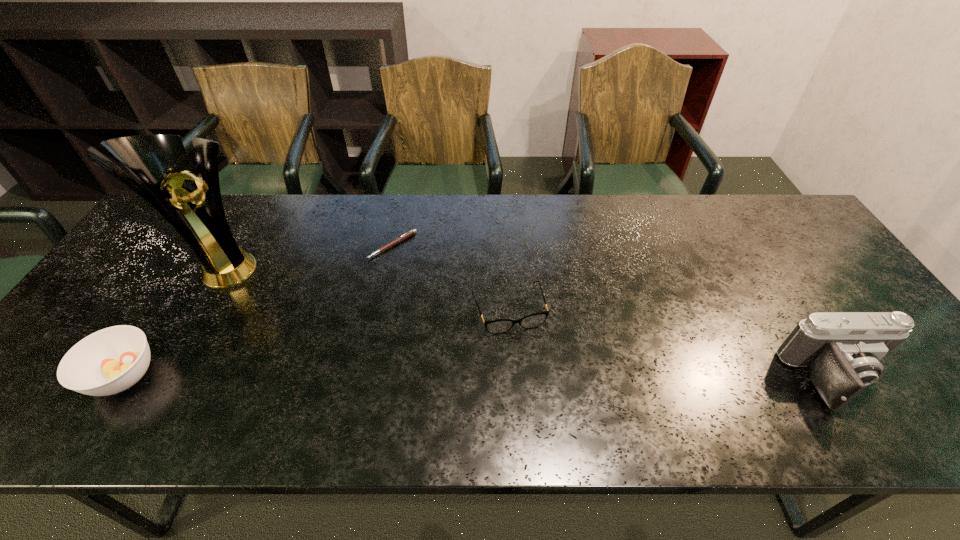
Where is `soup bowl`? The width and height of the screenshot is (960, 540). soup bowl is located at coordinates (109, 361).

Identify the location of camera. The height and width of the screenshot is (540, 960). (842, 351).

Find the location of a particular element. The height and width of the screenshot is (540, 960). the fourth shortest object is located at coordinates (842, 351).

This screenshot has width=960, height=540. Identify the location of the third object from right to left. (411, 232).

At what (x,y) coordinates should I click in order to perform the action: click on pen. Please return your answer as a coordinate pair (x, y). The image size is (960, 540). Looking at the image, I should click on (411, 232).

The height and width of the screenshot is (540, 960). I want to click on spectacles, so click(x=498, y=326).

Identify the location of the fourth object from left to right. (498, 326).

Locate an element on the screen. the tallest object is located at coordinates (192, 205).

This screenshot has width=960, height=540. I want to click on free space located 0.400m on the right of the soup bowl, so click(336, 376).

Where is `free region located 0.070m at the nib of the third object from left to right`? The height and width of the screenshot is (540, 960). free region located 0.070m at the nib of the third object from left to right is located at coordinates (396, 277).